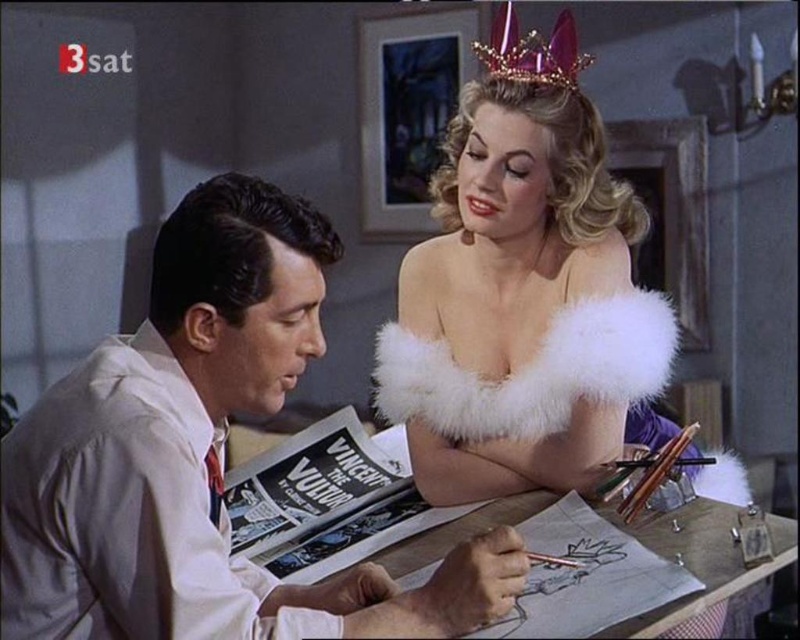
You are a costume designer analyzing the image. The point at coordinates (200, 456) is part of an object in the scene. Which object does this point belong to?

The point at coordinates (200, 456) belongs to the white satin shirt at left.

You are a photographer positioned behind the camera aiming to capture a clear shot of both the white satin shirt at left and the purple metallic crown at upper center. Since you can only focus on one object at a time, which object should you focus on first to ensure the other remains in the background?

You should focus on the white satin shirt at left first because it is closer to the viewer, and the purple metallic crown at upper center will naturally be in the background.

You are a character in the film scene. You need to place a small object between the two points, point 1 at point (480, 618) and point 2 at point (470, 378). Which point should you place it closer to so that it appears larger in the scene?

You should place the small object closer to point (480, 618) because it is closer to the viewer than point (470, 378). Objects placed closer to the viewer appear larger in the scene.